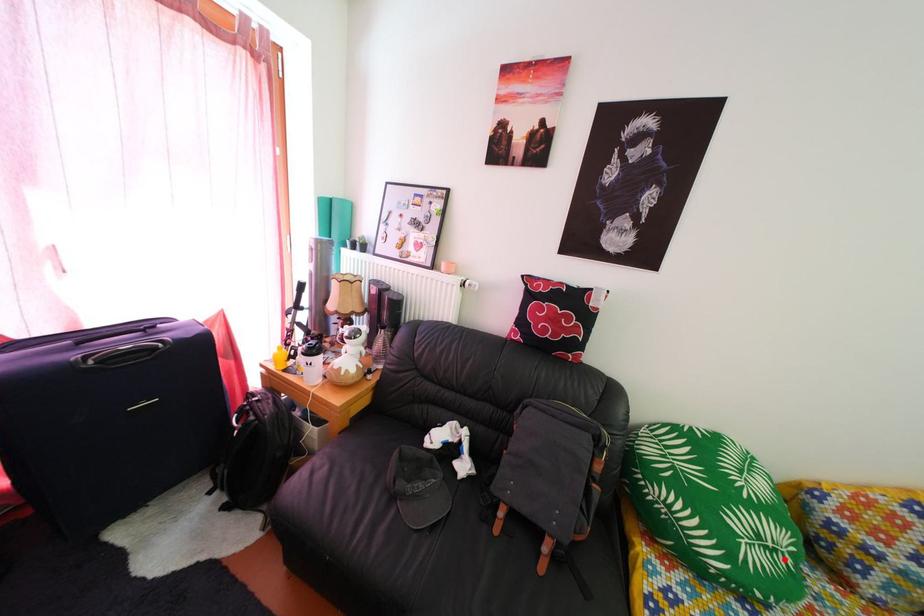
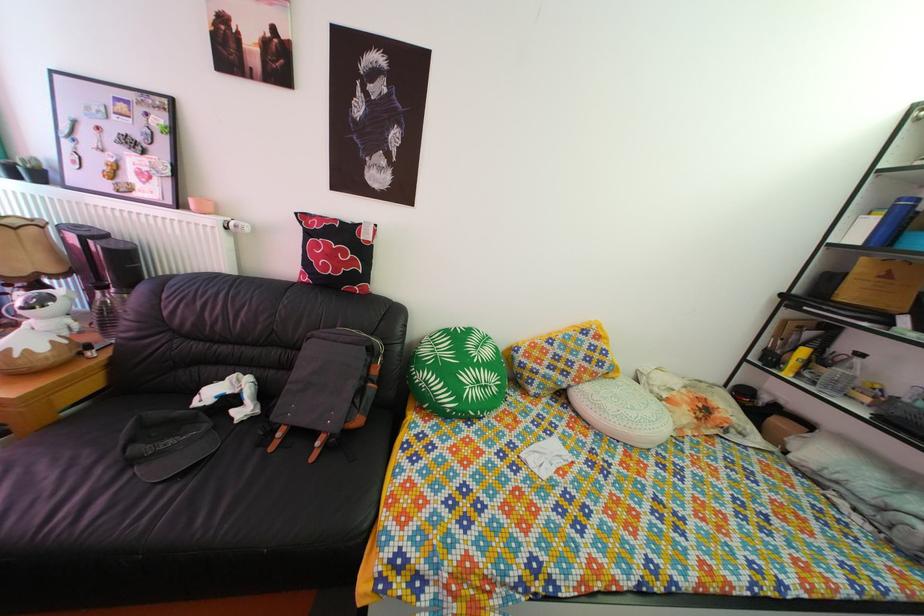
In the second image, find the point that corresponds to the highlighted location in the first image.

(494, 395)